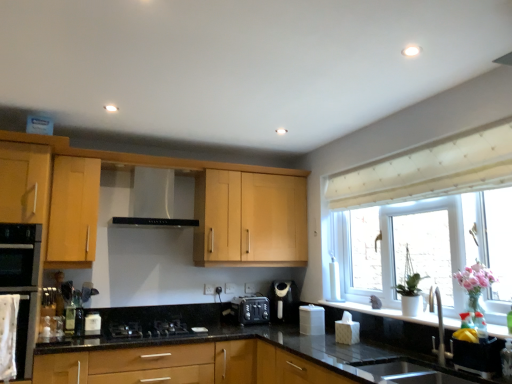
Question: Is point (458, 173) positioned closer to the camera than point (74, 322)?

Choices:
 (A) farther
 (B) closer

Answer: (B)

Question: Looking at their shapes, would you say white plastic window at center is wider or thinner than translucent glass bottle at lower left?

Choices:
 (A) thin
 (B) wide

Answer: (B)

Question: Which object is the closest to the black matte exhaust hood at center?

Choices:
 (A) black plastic toaster at center
 (B) black matte oven at left
 (C) black matte gas stove at center
 (D) translucent glass bottle at lower left
 (E) black granite countertop at center

Answer: (B)

Question: Based on their relative distances, which object is nearer to the pink glass vase at right?

Choices:
 (A) black matte gas stove at center
 (B) white plastic window at center
 (C) translucent glass bottle at lower left
 (D) satin black coffee machine at center
 (E) black glossy sink at lower right, which is the second sink in bottom-to-top order

Answer: (E)